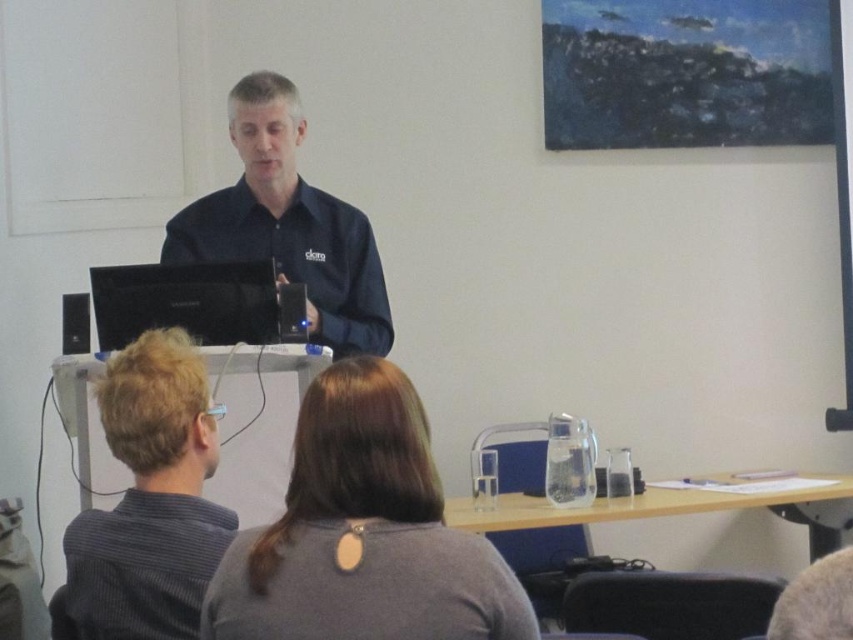
Question: Does gray fabric shirt at center appear over black glossy laptop at center?

Choices:
 (A) yes
 (B) no

Answer: (B)

Question: Estimate the real-world distances between objects in this image. Which object is farther from the gray striped shirt at lower left?

Choices:
 (A) black plastic speaker at left
 (B) gray fabric shirt at center
 (C) black glossy laptop at center

Answer: (A)

Question: Among these points, which one is farthest from the camera?

Choices:
 (A) (254, 141)
 (B) (78, 301)
 (C) (193, 264)
 (D) (177, 428)

Answer: (A)

Question: Is gray striped shirt at lower left wider than black glossy laptop at center?

Choices:
 (A) no
 (B) yes

Answer: (A)

Question: Which point is farther to the camera?

Choices:
 (A) gray striped shirt at lower left
 (B) black glossy laptop at center

Answer: (B)

Question: Considering the relative positions of gray fabric shirt at center and black plastic speaker at left in the image provided, where is gray fabric shirt at center located with respect to black plastic speaker at left?

Choices:
 (A) below
 (B) above

Answer: (A)